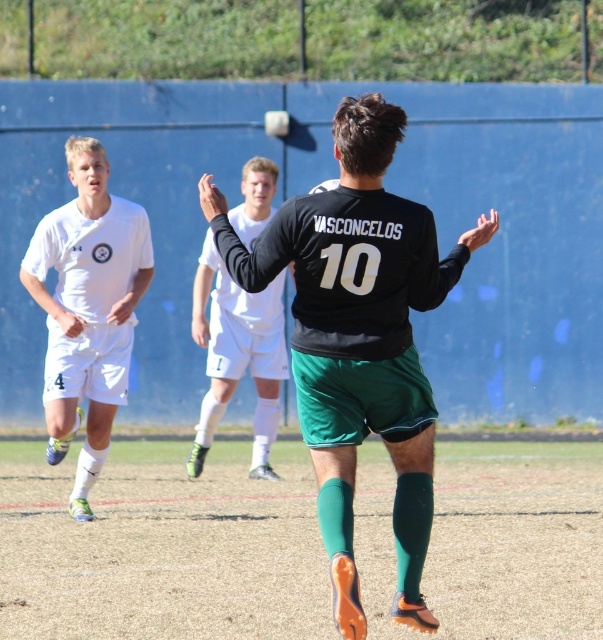
Looking at this image, you are a soccer coach analyzing a match. You see the white matte soccer uniform at left in the image. What are its coordinates?

The white matte soccer uniform at left is located at coordinates point (87, 308).

You are a sports analyst watching the soccer match. You notice the black matte jersey at center and the white matte soccer uniform at left. Which player has a wider uniform?

The black matte jersey at center has a greater width than the white matte soccer uniform at left, so the player wearing the black matte jersey at center has a wider uniform.